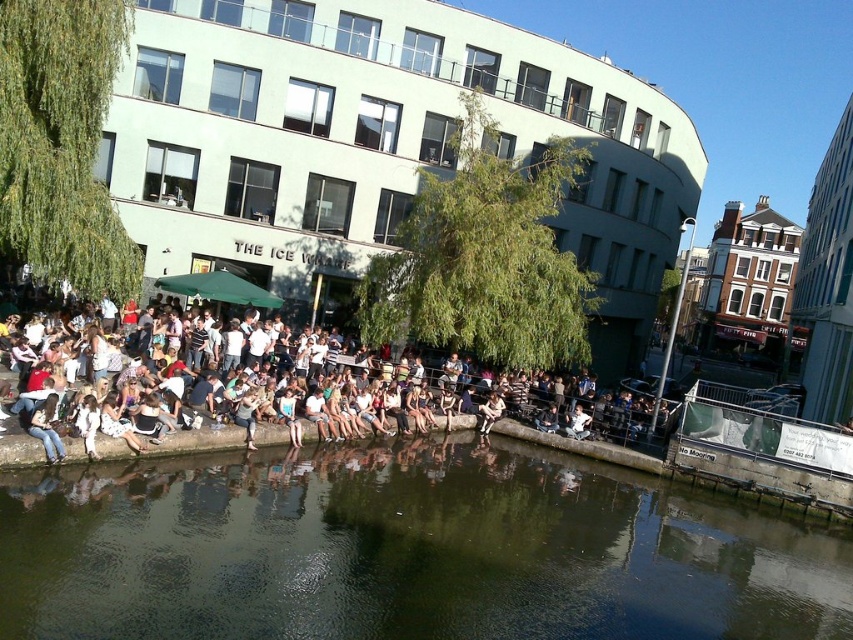
Question: Which object is positioned closest to the greenish water at lower center?

Choices:
 (A) denim jacket at lower center
 (B) white casual clothing at center

Answer: (B)

Question: Which object is positioned closest to the white casual clothing at center?

Choices:
 (A) greenish water at lower center
 (B) denim jeans at lower left
 (C) denim jacket at lower center

Answer: (C)

Question: Is white casual clothing at center above denim jeans at lower left?

Choices:
 (A) yes
 (B) no

Answer: (A)

Question: Based on their relative distances, which object is nearer to the denim jeans at lower left?

Choices:
 (A) greenish water at lower center
 (B) denim jacket at lower center

Answer: (A)

Question: Can you confirm if white casual clothing at center is bigger than denim jacket at lower center?

Choices:
 (A) yes
 (B) no

Answer: (A)

Question: Is denim jeans at lower left behind denim jacket at lower center?

Choices:
 (A) yes
 (B) no

Answer: (B)